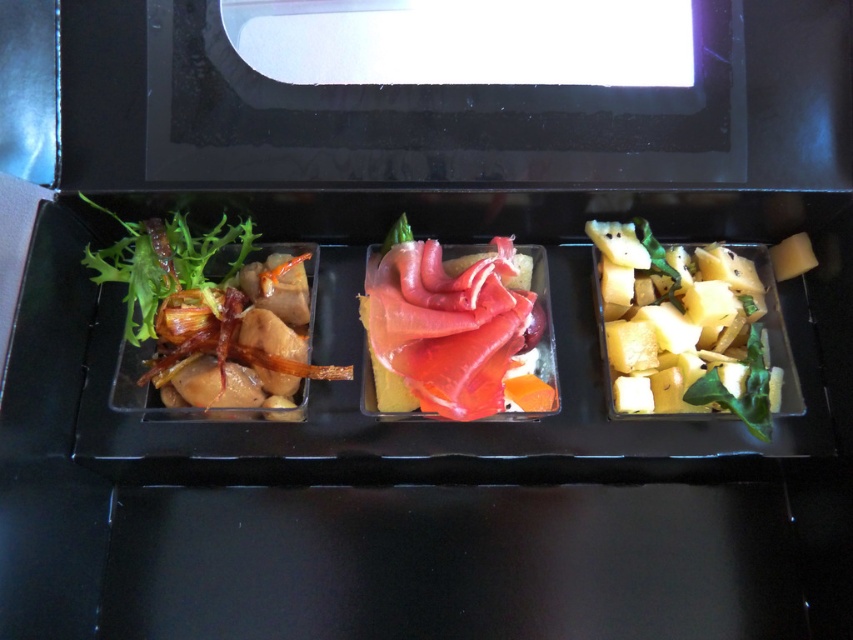
Can you confirm if yellow crumbly cheese at right is positioned to the left of pink raw fish at center?

No, yellow crumbly cheese at right is not to the left of pink raw fish at center.

Locate an element on the screen. yellow crumbly cheese at right is located at coordinates (682, 330).

Describe the element at coordinates (210, 317) in the screenshot. I see `glossy brown salad at left` at that location.

Between glossy brown salad at left and yellow crumbly cheese at right, which one appears on the right side from the viewer's perspective?

yellow crumbly cheese at right

Who is more distant from viewer, (202,275) or (677,342)?

The point (202,275) is behind.

What are the coordinates of `glossy brown salad at left` in the screenshot? It's located at (210, 317).

Between glossy brown salad at left and pink raw fish at center, which one appears on the left side from the viewer's perspective?

From the viewer's perspective, glossy brown salad at left appears more on the left side.

At what (x,y) coordinates should I click in order to perform the action: click on glossy brown salad at left. Please return your answer as a coordinate pair (x, y). The height and width of the screenshot is (640, 853). Looking at the image, I should click on (210, 317).

What do you see at coordinates (210, 317) in the screenshot?
I see `glossy brown salad at left` at bounding box center [210, 317].

Identify the location of glossy brown salad at left. (210, 317).